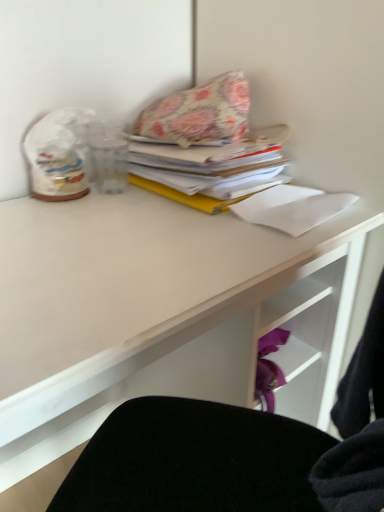
The image size is (384, 512). In order to click on blank space to the left of white paper at upper right in this screenshot , I will do `click(197, 236)`.